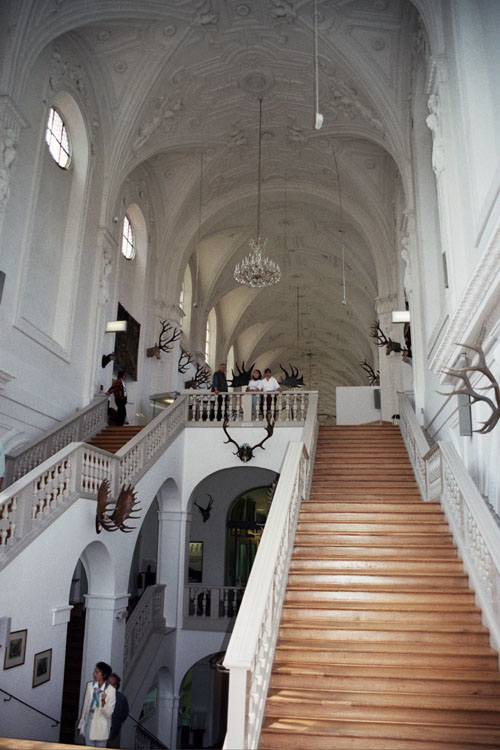
Where is `white rail on left side of brown staircase`? This screenshot has width=500, height=750. white rail on left side of brown staircase is located at coordinates (252, 592), (291, 469).